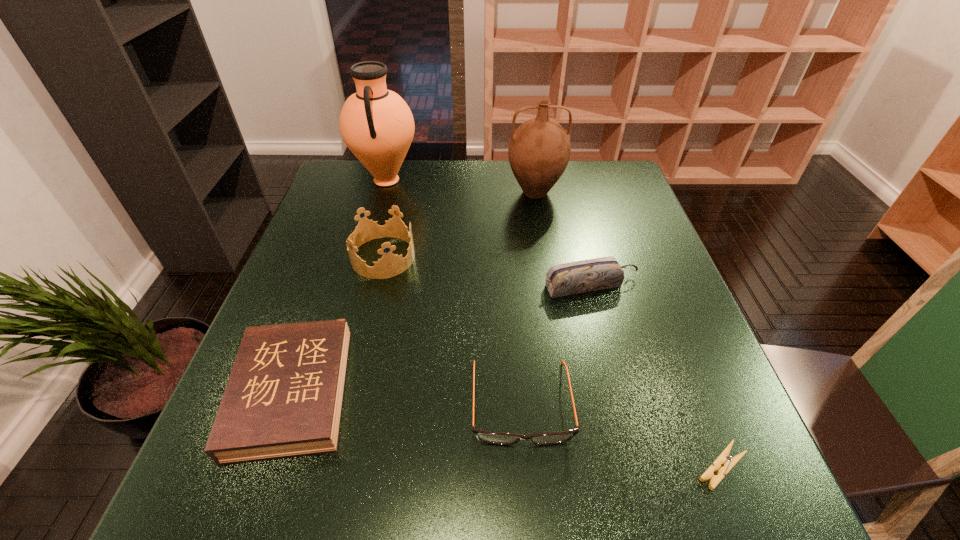
Locate an element on the screen. The height and width of the screenshot is (540, 960). vacant point located between the second tallest object and the hardback book is located at coordinates (414, 293).

The width and height of the screenshot is (960, 540). Find the location of `free space between the fourth tallest object and the tiara`. free space between the fourth tallest object and the tiara is located at coordinates (487, 272).

The width and height of the screenshot is (960, 540). Find the location of `free space between the pencil box and the spectacles`. free space between the pencil box and the spectacles is located at coordinates (556, 344).

I want to click on free spot between the hardback book and the tallest object, so click(340, 287).

Where is `free space that is in between the spectacles and the clothespin`? This screenshot has height=540, width=960. free space that is in between the spectacles and the clothespin is located at coordinates (621, 434).

Where is `free space between the fourth shortest object and the fifth shortest object`? free space between the fourth shortest object and the fifth shortest object is located at coordinates (487, 272).

What are the coordinates of `free space that is in between the tiara and the sixth shortest object` in the screenshot? It's located at (459, 225).

Image resolution: width=960 pixels, height=540 pixels. I want to click on vacant area that lies between the fifth shortest object and the pencil box, so click(487, 272).

In order to click on empty space that is in between the pencil box and the right pitcher in this screenshot , I will do `click(563, 239)`.

At what (x,y) coordinates should I click in order to perform the action: click on free space between the sixth shortest object and the clothespin. Please return your answer as a coordinate pair (x, y). This screenshot has height=540, width=960. Looking at the image, I should click on (629, 329).